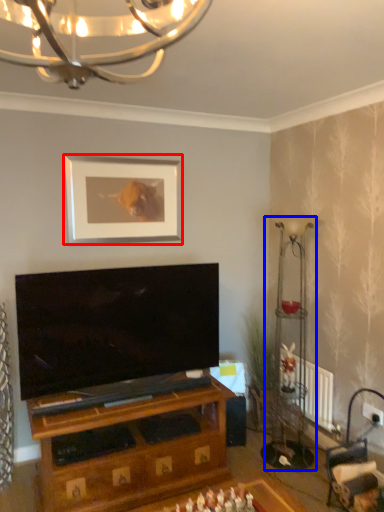
Question: Which of the following is the closest to the observer, picture frame (highlighted by a red box) or lamp (highlighted by a blue box)?

Choices:
 (A) picture frame
 (B) lamp

Answer: (B)